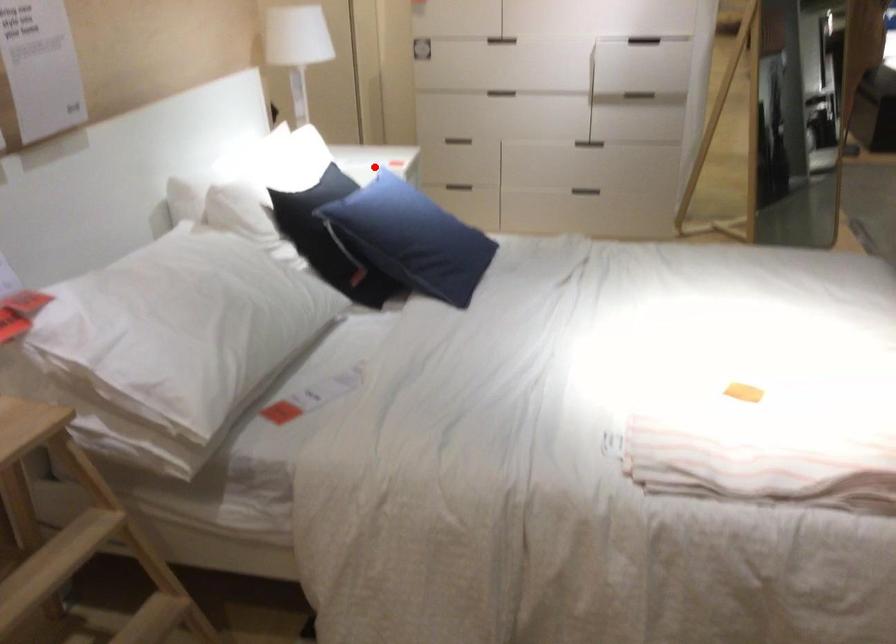
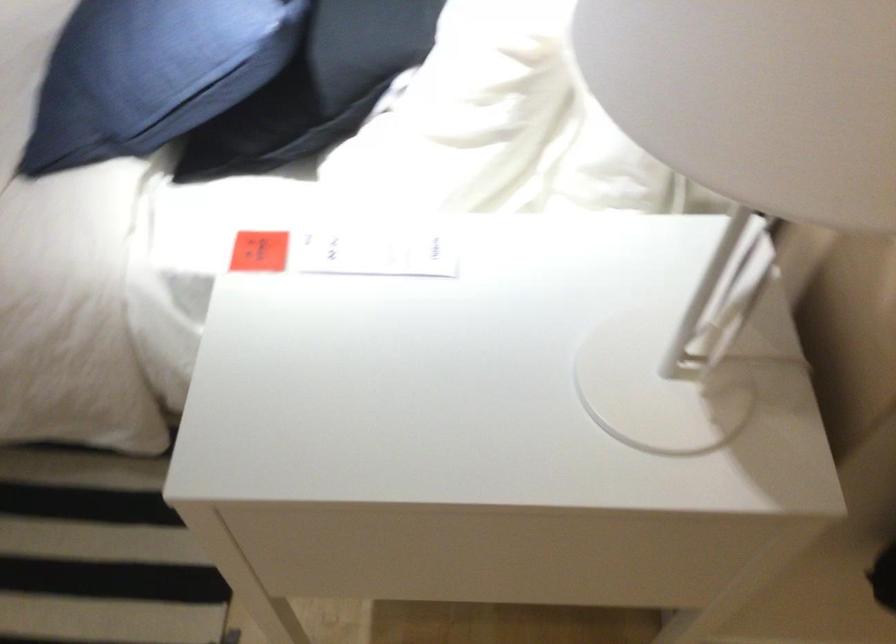
In the second image, find the point that corresponds to the highlighted location in the first image.

(375, 252)